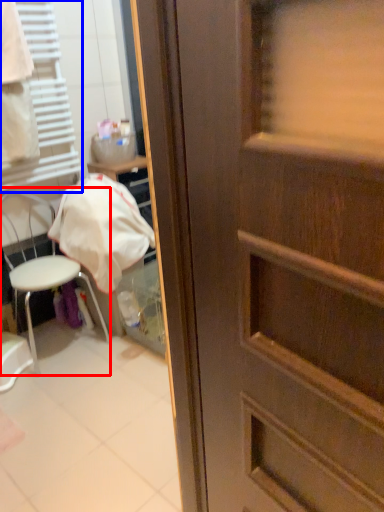
Question: Which object is closer to the camera taking this photo, chair (highlighted by a red box) or shutter (highlighted by a blue box)?

Choices:
 (A) chair
 (B) shutter

Answer: (B)